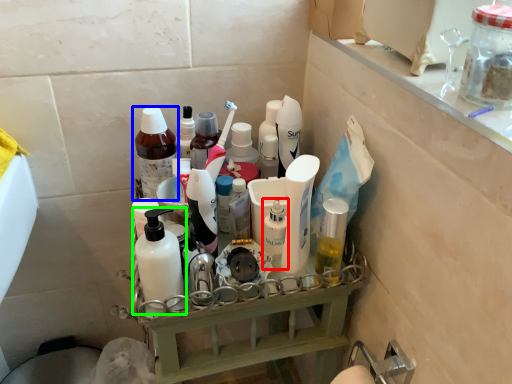
Question: Based on their relative distances, which object is farther from toiletry (highlighted by a red box)? Choose from bottle (highlighted by a blue box) and bottle (highlighted by a green box).

Choices:
 (A) bottle
 (B) bottle

Answer: (A)